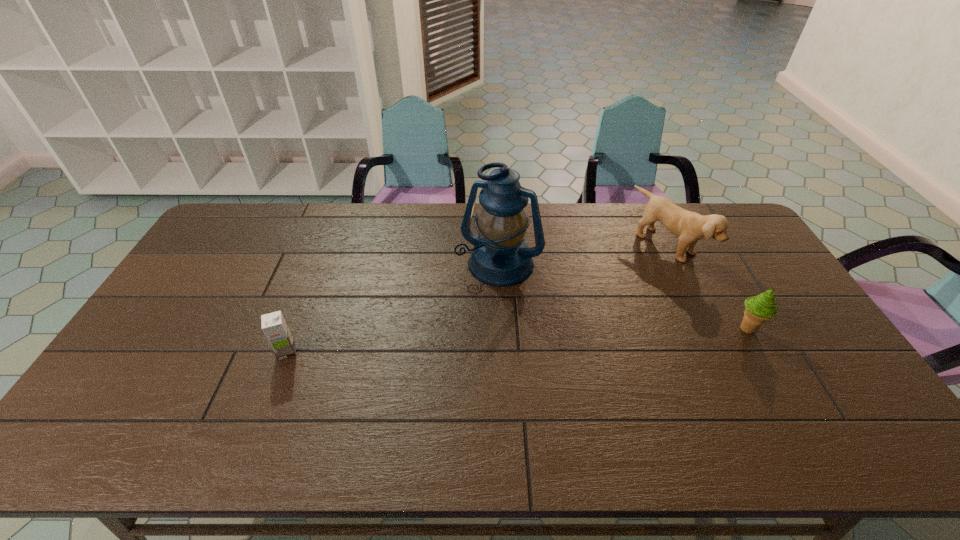
The width and height of the screenshot is (960, 540). Identify the location of vacant space located 0.170m on the left side of the puppy. (616, 287).

At what (x,y) coordinates should I click in order to perform the action: click on vacant space positioned on the face of the tallest object. Please return your answer as a coordinate pair (x, y). Image resolution: width=960 pixels, height=540 pixels. Looking at the image, I should click on (451, 351).

You are a GUI agent. You are given a task and a screenshot of the screen. Output one action in this format:
    pyautogui.click(x=<x>, y=<y>)
    Task: Click on the free spot located 0.250m on the face of the tallest object
    The width and height of the screenshot is (960, 540).
    Given the screenshot: What is the action you would take?
    pyautogui.click(x=454, y=346)

Find the location of `vacant space situated on the face of the tallest object`. vacant space situated on the face of the tallest object is located at coordinates (471, 310).

You are a GUI agent. You are given a task and a screenshot of the screen. Output one action in this format:
    pyautogui.click(x=<x>, y=<y>)
    Task: Click on the puppy present at the far edge
    
    Given the screenshot: What is the action you would take?
    pyautogui.click(x=690, y=227)

You are a GUI agent. You are given a task and a screenshot of the screen. Output one action in this format:
    pyautogui.click(x=<x>, y=<y>)
    Task: Click on the lantern at the far edge
    
    Given the screenshot: What is the action you would take?
    pyautogui.click(x=500, y=257)

I want to click on object located at the right edge, so pyautogui.click(x=759, y=309).

This screenshot has width=960, height=540. Find the location of `vacant region at the far edge of the desktop`. vacant region at the far edge of the desktop is located at coordinates (333, 238).

In the image, there is a desktop. Where is `vacant area at the near edge`? vacant area at the near edge is located at coordinates (x=560, y=412).

The width and height of the screenshot is (960, 540). Find the location of `vacant position at the left edge of the desktop`. vacant position at the left edge of the desktop is located at coordinates (184, 291).